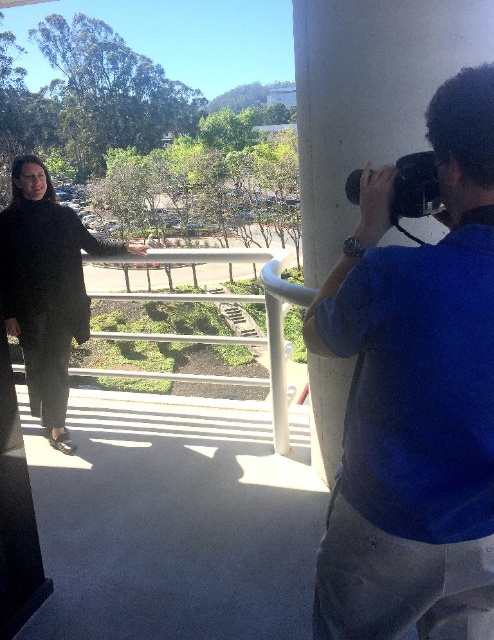
Based on the photo, you are organizing a clothing donation drive and need to determine which item takes up less space. Based on the image, which of the two items, the blue cotton shirt at right or the black textured coat at left, is more suitable for packing efficiently?

The blue cotton shirt at right is thinner than the black textured coat at left, so it takes up less space and is more suitable for packing efficiently.

From the picture: You are standing on the balcony and want to place a small potted plant between the two people. The potted plant must be placed exactly at point [45,289]. Is there enough space at that point to place the potted plant?

At point [45,289] lies the black textured coat at left, so placing the potted plant there would require moving the coat first.